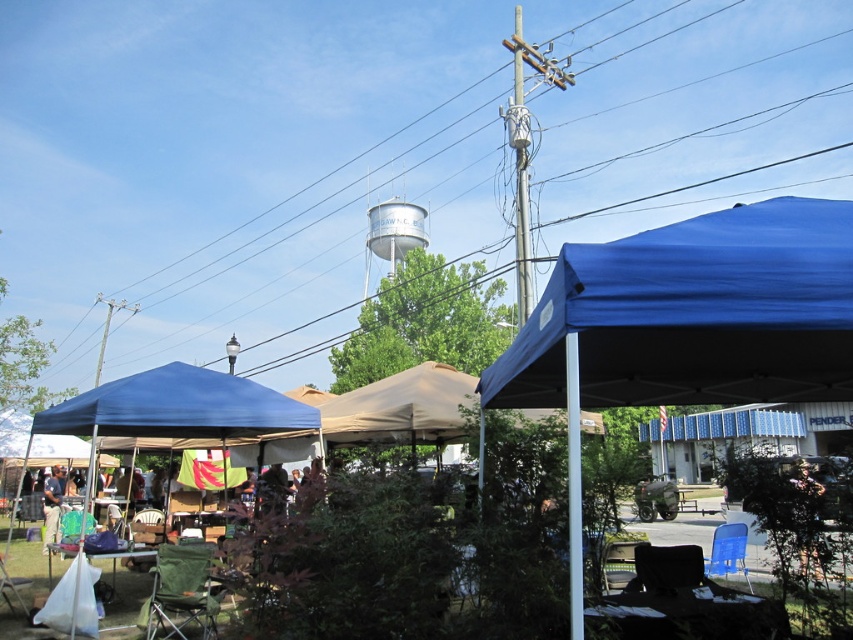
In the scene shown: Does blue fabric tent at upper center appear on the left side of white metallic water tower at upper center?

No, blue fabric tent at upper center is not to the left of white metallic water tower at upper center.

Who is positioned more to the left, blue fabric tent at upper center or white metallic water tower at upper center?

white metallic water tower at upper center is more to the left.

Between point (848, 337) and point (373, 244), which one is positioned in front?

Point (848, 337) is in front.

The height and width of the screenshot is (640, 853). In order to click on blue fabric tent at upper center in this screenshot , I will do `click(692, 314)`.

Can you confirm if metallic gray pole at center is shorter than white metallic water tower at upper center?

No, metallic gray pole at center is not shorter than white metallic water tower at upper center.

Which is below, metallic gray pole at center or white metallic water tower at upper center?

white metallic water tower at upper center is lower down.

Between point (529, 308) and point (393, 243), which one is positioned in front?

Point (529, 308) is in front.

This screenshot has width=853, height=640. I want to click on metallic gray pole at center, so click(x=520, y=176).

Between blue fabric tent at left and wooden table at lower center, which one is positioned higher?

wooden table at lower center is higher up.

Between blue fabric tent at left and wooden table at lower center, which one has more height?

wooden table at lower center is taller.

Is point (90, 396) positioned after point (665, 620)?

Yes, point (90, 396) is farther from viewer.

What are the coordinates of `blue fabric tent at left` in the screenshot? It's located at (175, 406).